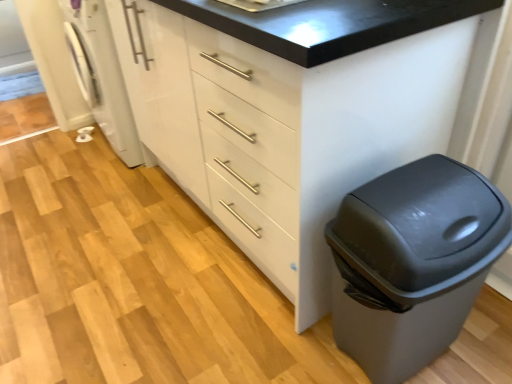
This screenshot has height=384, width=512. Identify the location of vacant region to the left of matte gray trash can at lower right. (283, 340).